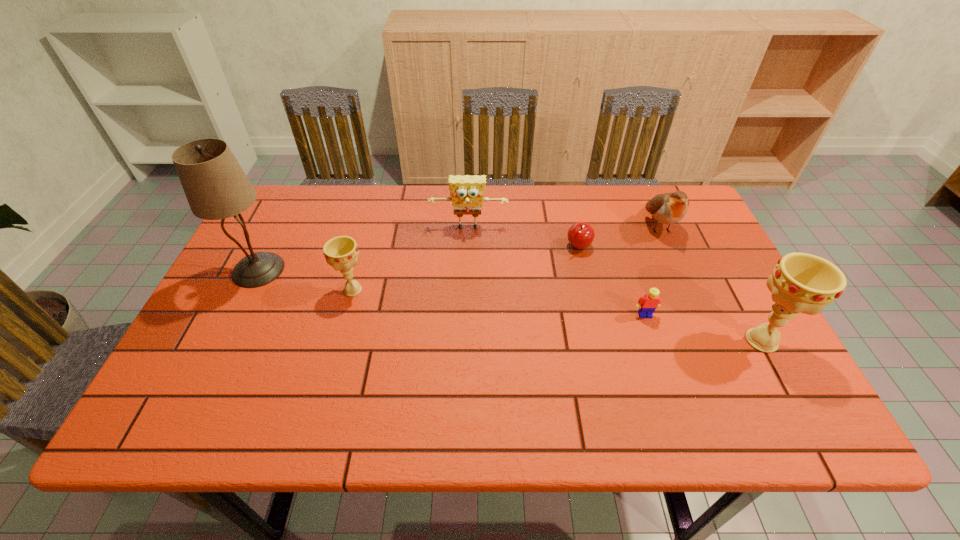
Where is `the fourth object from left to right`? Image resolution: width=960 pixels, height=540 pixels. the fourth object from left to right is located at coordinates (580, 235).

At what (x,y) coordinates should I click in order to perform the action: click on free point located 0.180m on the front of the second object from left to right. Please return your answer as a coordinate pair (x, y). The height and width of the screenshot is (540, 960). Looking at the image, I should click on (333, 364).

This screenshot has height=540, width=960. I want to click on vacant space located 0.400m on the back of the sixth shortest object, so click(694, 216).

You are a GUI agent. You are given a task and a screenshot of the screen. Output one action in this format:
    pyautogui.click(x=<x>, y=<y>)
    Task: Click on the vacant space situated at the face of the bird
    Image resolution: width=960 pixels, height=540 pixels.
    Given the screenshot: What is the action you would take?
    pyautogui.click(x=692, y=301)

The height and width of the screenshot is (540, 960). Find the location of `free space located on the face of the third object from left to right`. free space located on the face of the third object from left to right is located at coordinates pos(466,312).

I want to click on free space located 0.270m on the front-facing side of the tallest object, so click(x=387, y=270).

This screenshot has width=960, height=540. I want to click on free space located 0.130m on the front-facing side of the Lego, so 661,365.

Image resolution: width=960 pixels, height=540 pixels. What are the coordinates of `vacant area situated on the left of the fourth object from left to right` in the screenshot? It's located at (507, 246).

The height and width of the screenshot is (540, 960). In order to click on bird that is at the far edge in this screenshot , I will do `click(668, 208)`.

Where is `sponge that is at the far edge`? The height and width of the screenshot is (540, 960). sponge that is at the far edge is located at coordinates (467, 192).